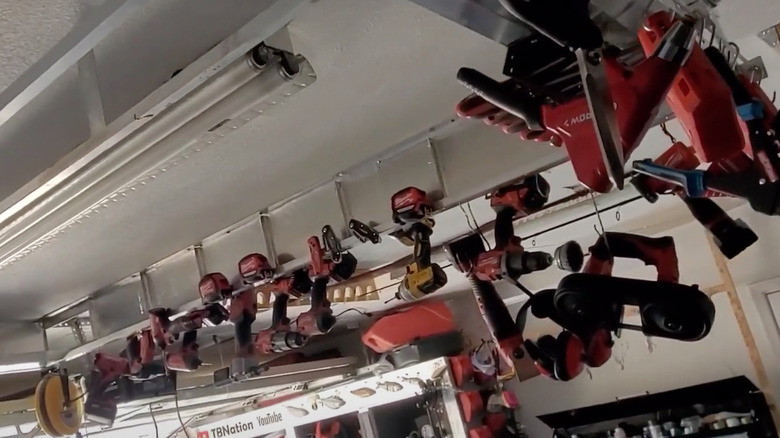
Identify the location of metal shelving. (452, 142).